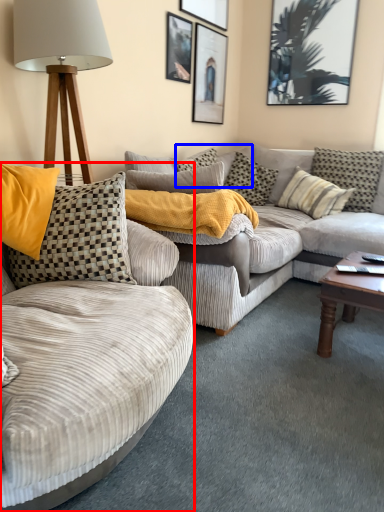
Question: Which point is further to the camera, studio couch (highlighted by a red box) or pillow (highlighted by a blue box)?

Choices:
 (A) studio couch
 (B) pillow

Answer: (B)